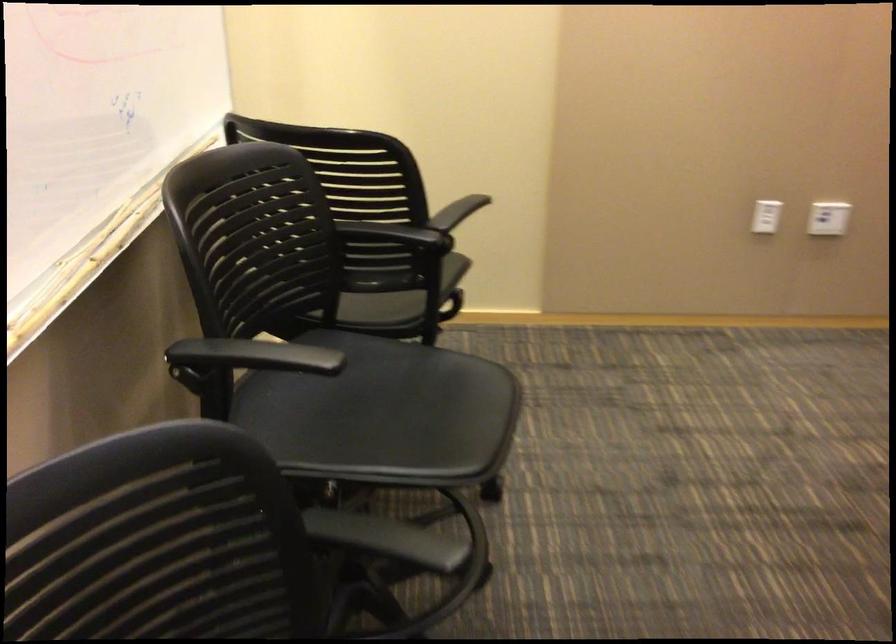
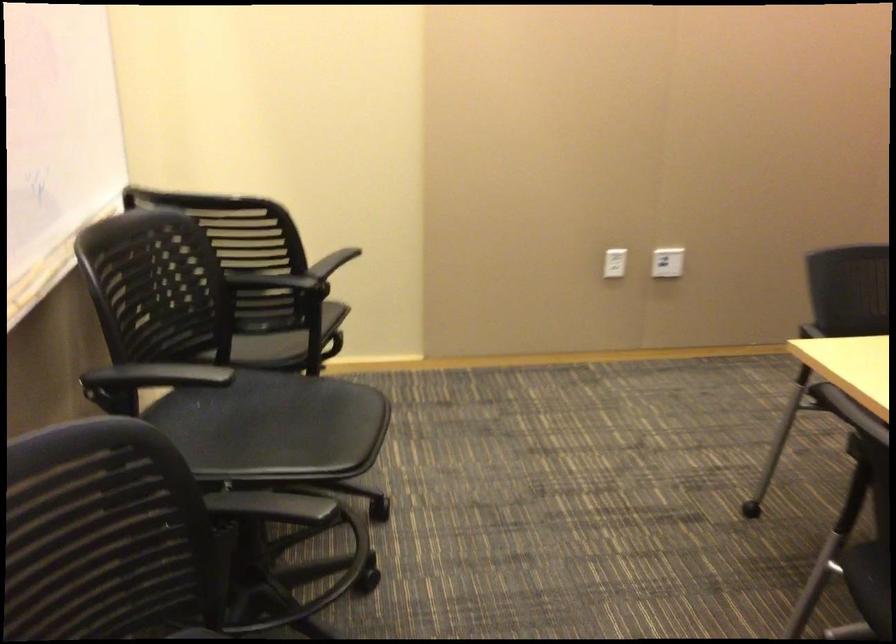
Question: I am providing you with two images of the same scene from different viewpoints. After the viewpoint changes to image2, which objects are now occluded?

Choices:
 (A) white wall outlet
 (B) black chair armrest
 (C) black chair sitting surface
 (D) none of these

Answer: (D)